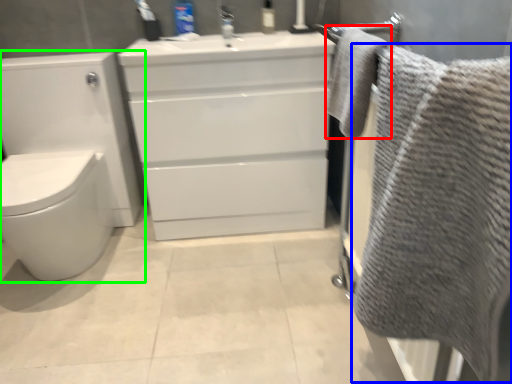
Question: Which is nearer to the bath towel (highlighted by a red box)? bath towel (highlighted by a blue box) or toilet (highlighted by a green box).

Choices:
 (A) bath towel
 (B) toilet

Answer: (A)